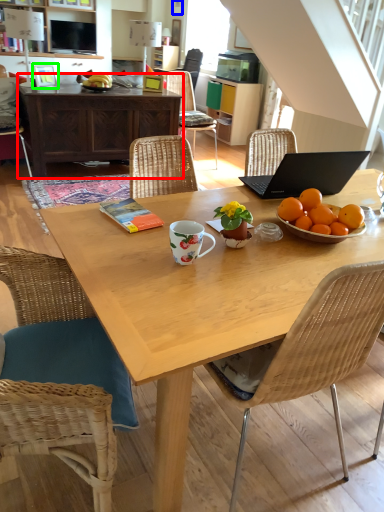
Question: Estimate the real-world distances between objects in this image. Which object is farther from desk (highlighted by a red box), picture frame (highlighted by a blue box) or picture frame (highlighted by a green box)?

Choices:
 (A) picture frame
 (B) picture frame

Answer: (A)